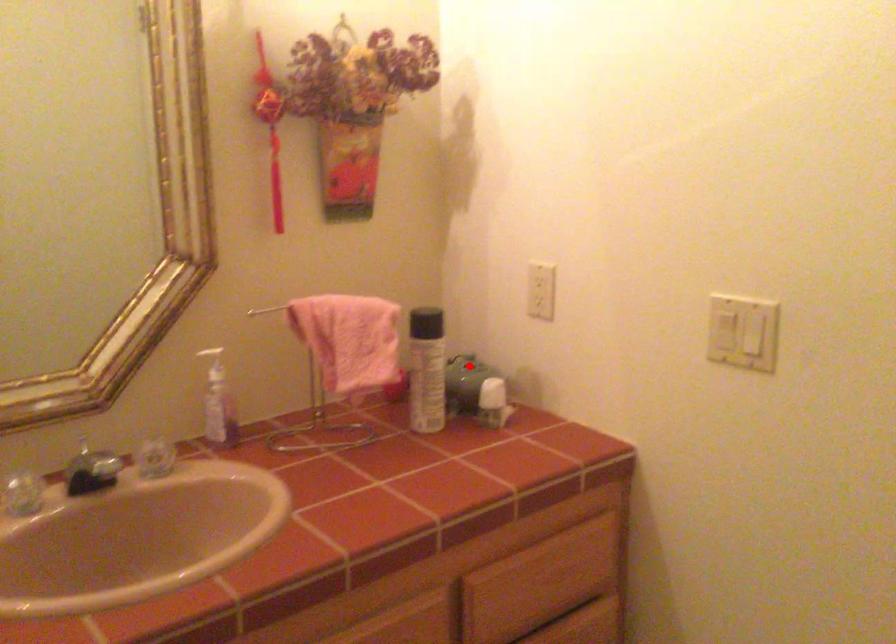
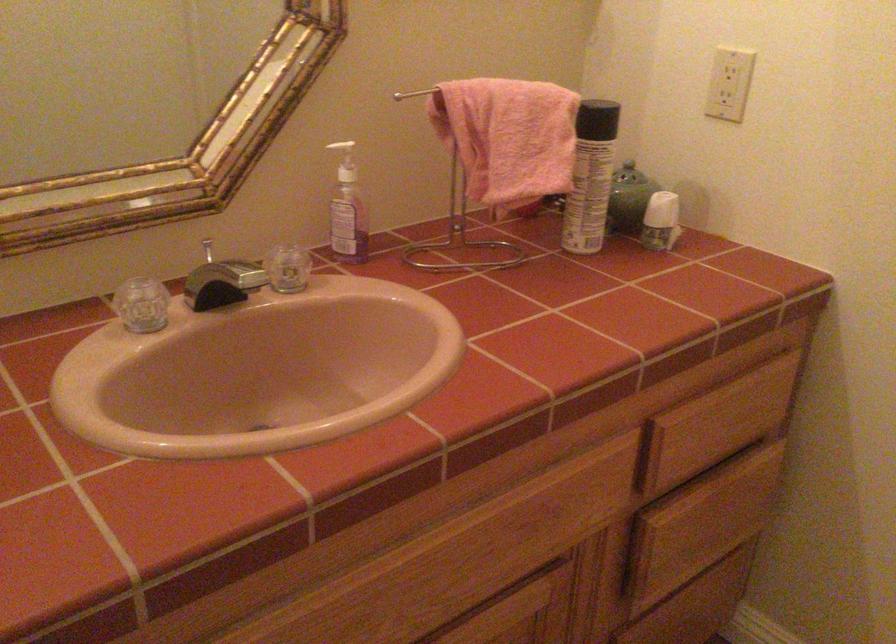
Locate, in the second image, the point that corresponds to the highlighted location in the first image.

(629, 175)